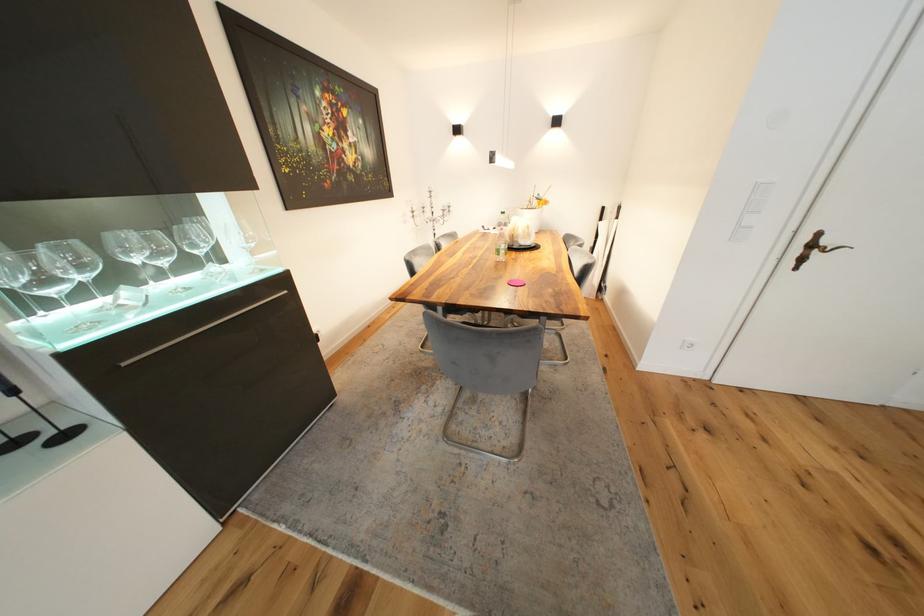
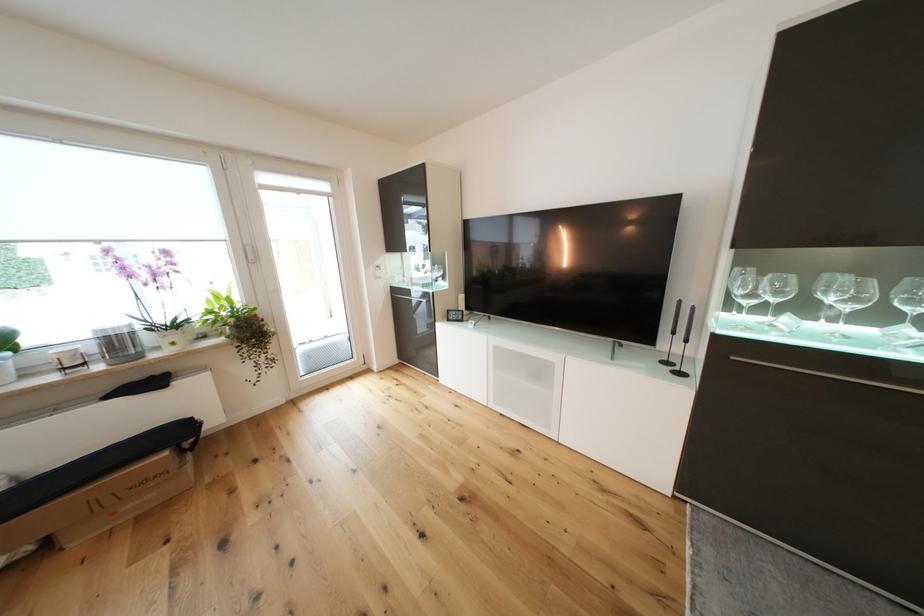
The first image is from the beginning of the video and the second image is from the end. How did the camera likely rotate when shooting the video?

The camera rotated toward left-down.